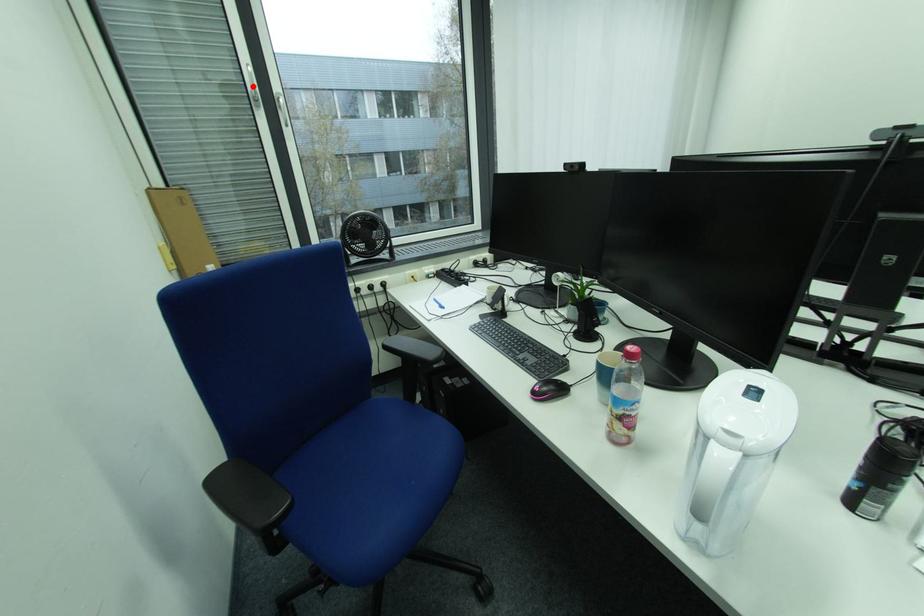
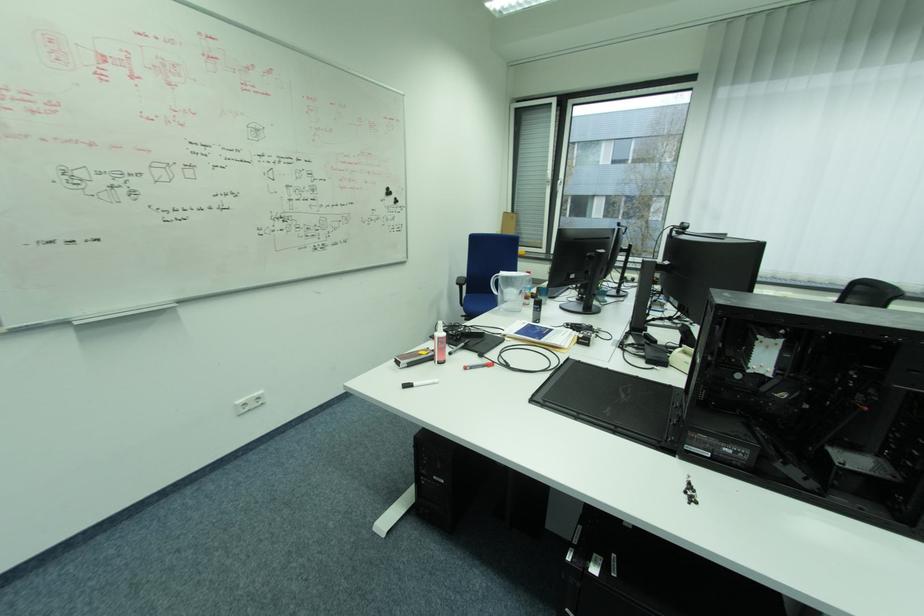
Question: I am providing you with two images of the same scene from different viewpoints. A red point is marked on the first image. Is the red point's position out of view in image 2?

Choices:
 (A) Yes
 (B) No

Answer: (A)